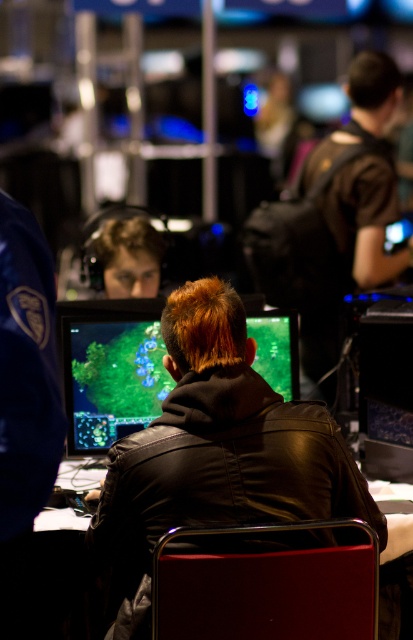
Is metallic red chair at center wider than matte black monitor at center?

Indeed, metallic red chair at center has a greater width compared to matte black monitor at center.

Who is more forward, (272, 566) or (75, 381)?

Point (272, 566) is more forward.

Between point (187, 611) and point (246, 307), which one is positioned behind?

The point (246, 307) is behind.

The width and height of the screenshot is (413, 640). What are the coordinates of `metallic red chair at center` in the screenshot? It's located at pyautogui.click(x=266, y=588).

Does black leather jacket at center have a smaller size compared to metallic red chair at center?

No.

Can you confirm if black leather jacket at center is taller than metallic red chair at center?

Yes, black leather jacket at center is taller than metallic red chair at center.

Is point (294, 532) in front of point (275, 525)?

No.

This screenshot has width=413, height=640. Identify the location of black leather jacket at center. (211, 458).

How far apart are matte black monitor at center and metallic table at center?

15.06 inches

Measure the distance between matte black monitor at center and metallic table at center.

matte black monitor at center is 15.06 inches away from metallic table at center.

You are a GUI agent. You are given a task and a screenshot of the screen. Output one action in this format:
    pyautogui.click(x=<x>, y=<y>)
    Task: Click on the matte black monitor at center
    The height and width of the screenshot is (640, 413).
    Given the screenshot: What is the action you would take?
    pyautogui.click(x=111, y=369)